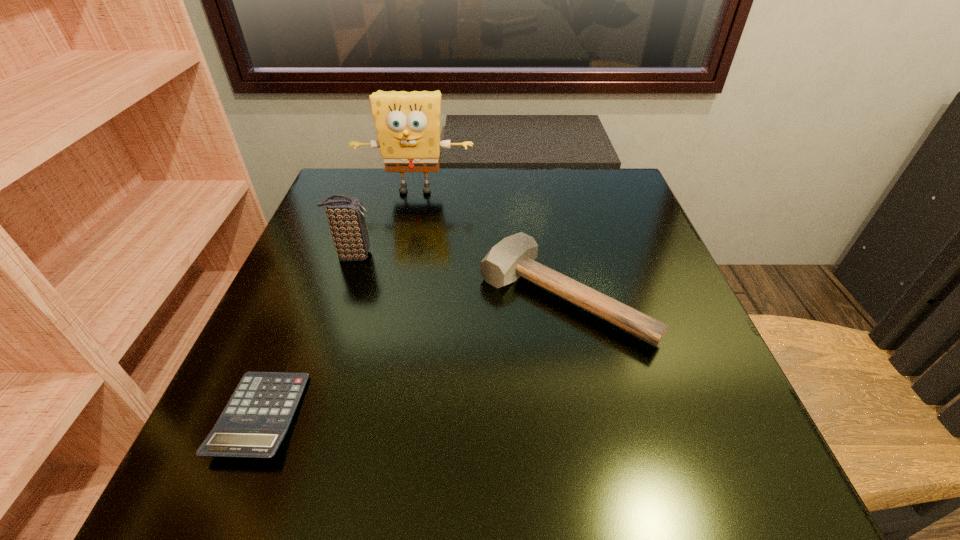
The width and height of the screenshot is (960, 540). In order to click on the farthest object in this screenshot , I will do `click(408, 123)`.

Locate an element on the screen. Image resolution: width=960 pixels, height=540 pixels. the tallest object is located at coordinates (408, 123).

This screenshot has width=960, height=540. What are the coordinates of `the second tallest object` in the screenshot? It's located at (346, 218).

Where is `the third tallest object`? The width and height of the screenshot is (960, 540). the third tallest object is located at coordinates (512, 257).

This screenshot has height=540, width=960. Find the location of `mallet`. mallet is located at coordinates (512, 257).

The width and height of the screenshot is (960, 540). Identify the location of the shortest object. (254, 422).

This screenshot has width=960, height=540. What are the coordinates of `the nearest object` in the screenshot? It's located at (254, 422).

In order to click on blank space located 0.390m on the face of the farthest object in this screenshot , I will do `click(389, 320)`.

Image resolution: width=960 pixels, height=540 pixels. I want to click on vacant space located 0.360m with the zip open on the clutch bag, so click(x=545, y=255).

Find the location of a particular element. The height and width of the screenshot is (540, 960). vacant space located on the back of the mallet is located at coordinates (544, 202).